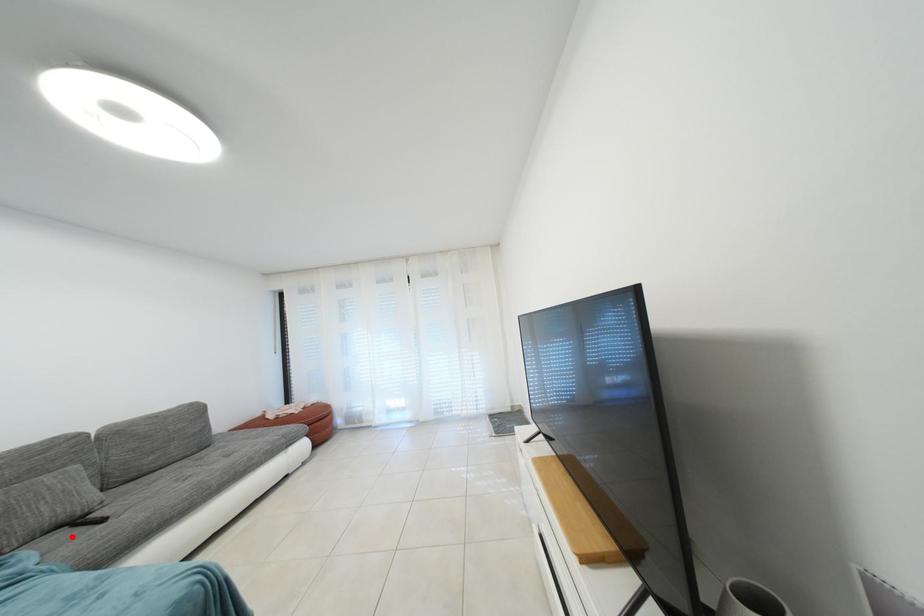
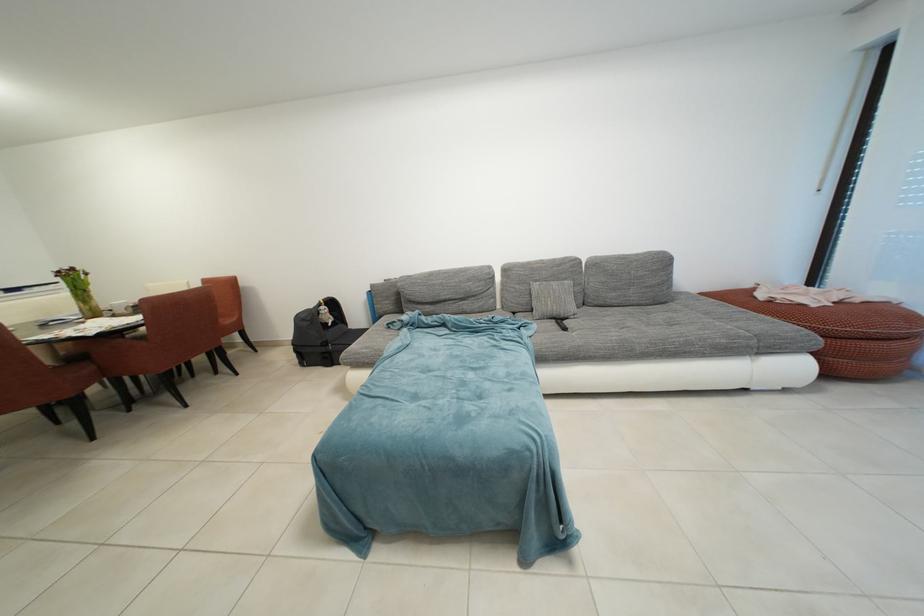
Locate, in the second image, the point that corresponds to the highlighted location in the first image.

(560, 328)